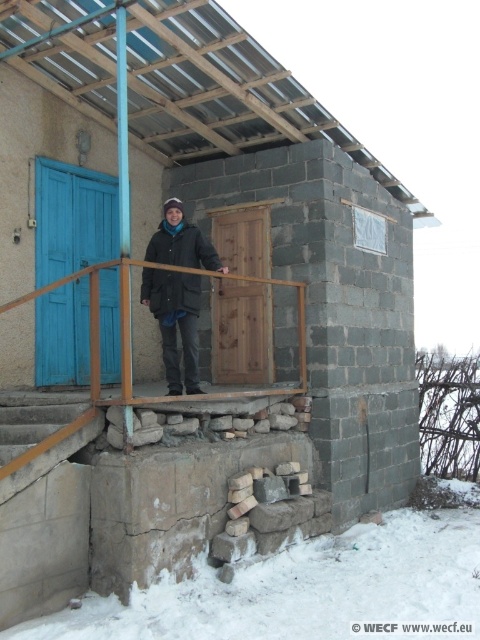
Who is positioned more to the left, white powdery snow at lower center or wooden door at center?

Positioned to the left is wooden door at center.

Between white powdery snow at lower center and wooden door at center, which one has less height?

With less height is white powdery snow at lower center.

Is point (407, 566) more distant than point (218, 216)?

No, it is in front of (218, 216).

The width and height of the screenshot is (480, 640). Find the location of `white powdery snow at lower center`. white powdery snow at lower center is located at coordinates (302, 586).

Does wooden door at center lie in front of dark green matte jacket at center?

No, wooden door at center is behind dark green matte jacket at center.

Who is more forward, (231, 209) or (211, 244)?

Point (211, 244) is in front.

Where is `wooden door at center`? wooden door at center is located at coordinates (240, 332).

Can you confirm if blue wooden door at left is positioned to the left of dark green matte jacket at center?

Indeed, blue wooden door at left is positioned on the left side of dark green matte jacket at center.

Can you confirm if blue wooden door at left is wider than dark green matte jacket at center?

No.

The height and width of the screenshot is (640, 480). Find the location of `blue wooden door at left`. blue wooden door at left is located at coordinates (72, 218).